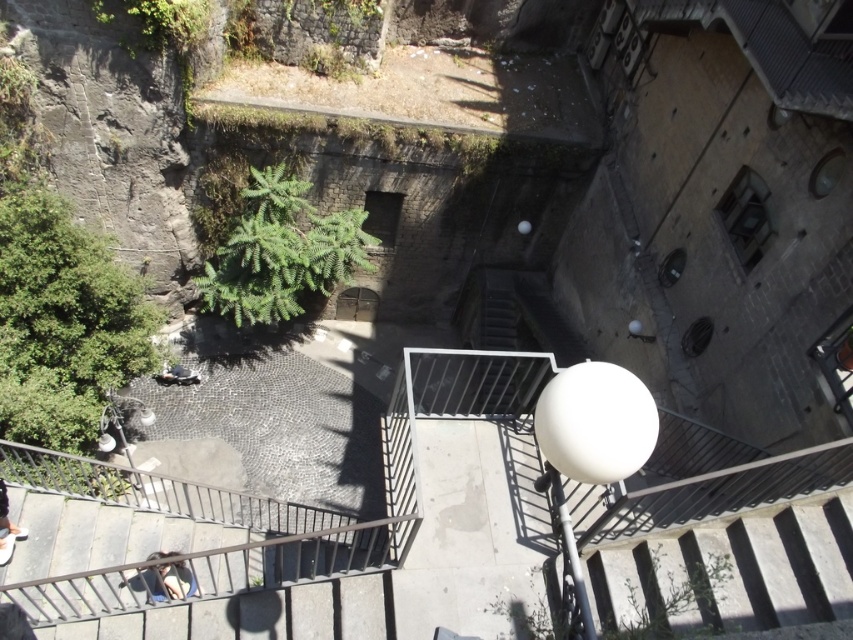
You are standing at the top of the stairs looking down. You see two points marked in the image. The first point is at coordinates point (775, 593) and the second is at point (177, 371). Which point is closer to you?

Point (775, 593) is in front of point (177, 371), so the point closer to you is point (775, 593).

You are standing on the rooftop and looking down at the scene. You see the dark blue jeans at lower left. Where exactly are the dark blue jeans positioned relative to the stone stairs and the paved area?

The dark blue jeans at lower left are located at point coordinates of (170,580), which places them near the bottom of the stone stairs on the paved area below.

You are standing on the balcony looking down at the stairs and paved area. You need to place a 6 feet long wooden board between the dark blue jeans at lower left and dark blue jeans at bottom left. Will the board fit perfectly between them?

The dark blue jeans at lower left is 5.97 feet away from dark blue jeans at bottom left. The board is 6 feet long, which is slightly longer than the distance between them. Therefore, the board will not fit perfectly and may need to be adjusted or shortened by approximately 0.03 feet to fit between the two jeans.